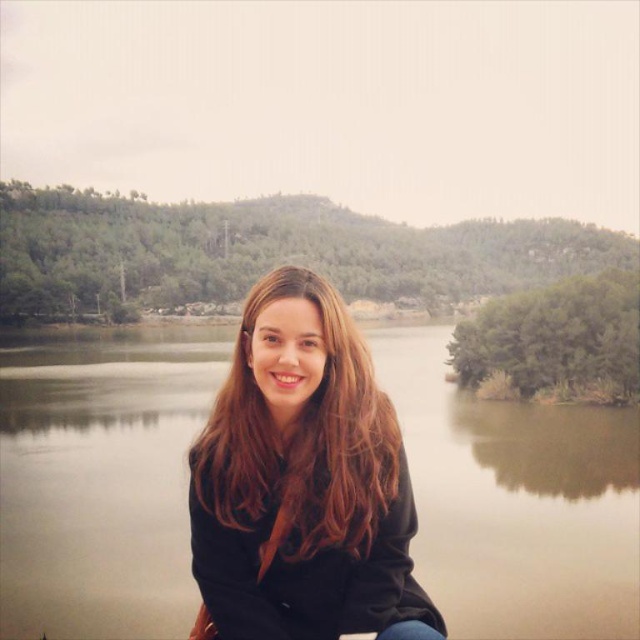
Question: Does green matte water at center have a greater width compared to brown hair at center?

Choices:
 (A) no
 (B) yes

Answer: (B)

Question: Observing the image, what is the correct spatial positioning of green matte water at center in reference to brown hair at center?

Choices:
 (A) above
 (B) below

Answer: (A)

Question: Which point is farther from the camera taking this photo?

Choices:
 (A) (148, 436)
 (B) (408, 618)

Answer: (A)

Question: Among these objects, which one is farthest from the camera?

Choices:
 (A) green matte water at center
 (B) brown hair at center

Answer: (A)

Question: Among these points, which one is farthest from the camera?

Choices:
 (A) (360, 476)
 (B) (461, 563)

Answer: (B)

Question: Can you confirm if green matte water at center is smaller than brown hair at center?

Choices:
 (A) no
 (B) yes

Answer: (A)